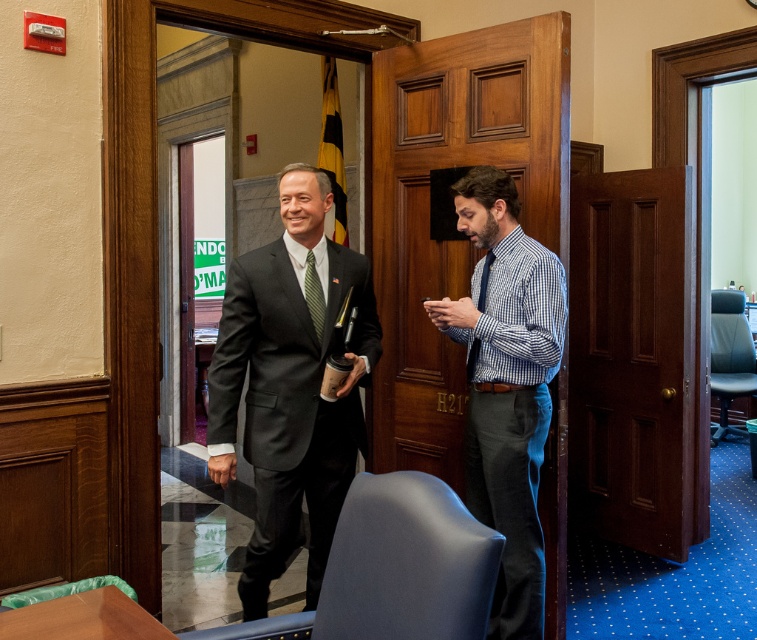
Question: Which is farther from the matte black suit at center?

Choices:
 (A) green textured tie at center
 (B) blue checkered shirt at center

Answer: (B)

Question: From the image, what is the correct spatial relationship of blue checkered shirt at center in relation to green textured tie at center?

Choices:
 (A) right
 (B) left

Answer: (A)

Question: Observing the image, what is the correct spatial positioning of matte black suit at center in reference to blue checkered shirt at center?

Choices:
 (A) below
 (B) above

Answer: (B)

Question: Among these points, which one is farthest from the camera?

Choices:
 (A) (516, 326)
 (B) (288, 228)

Answer: (B)

Question: Can you confirm if matte black suit at center is positioned to the right of blue checkered shirt at center?

Choices:
 (A) no
 (B) yes

Answer: (A)

Question: Which is nearer to the blue checkered shirt at center?

Choices:
 (A) matte black suit at center
 (B) green textured tie at center

Answer: (A)